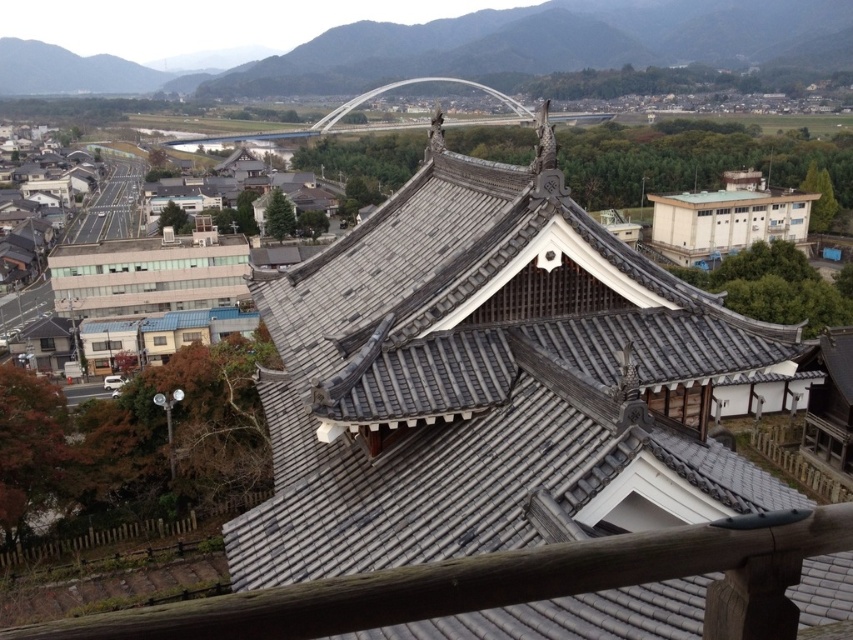
Based on the photo, you are standing at the temple balcony and see two points in the scene. The first point is labeled as point (442,353) and the second is point (804,244). Which point is closer to your current position?

Point (442,353) is in front of point (804,244), so it is closer to your current position.